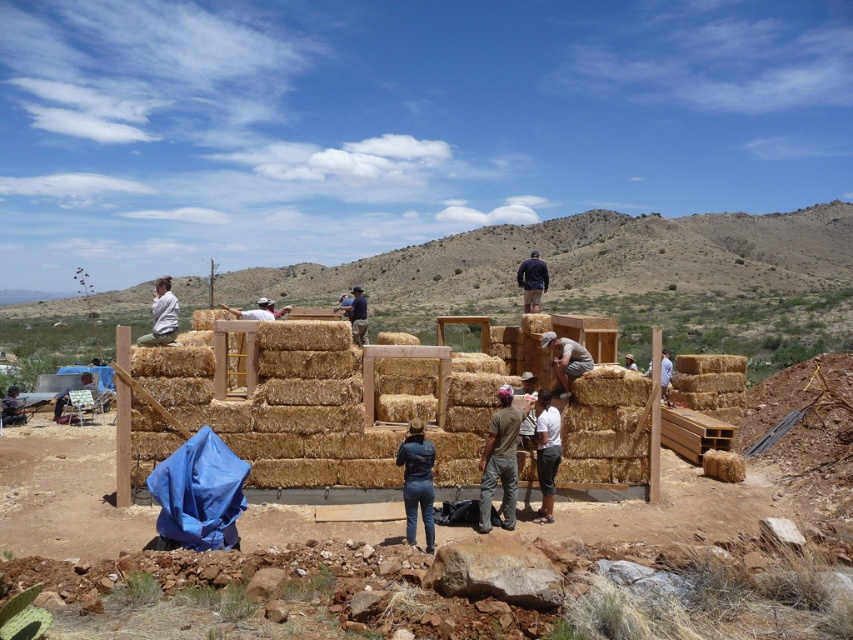
Does point (485, 461) come farther from viewer compared to point (553, 369)?

No, it is in front of (553, 369).

Consider the image. Can you confirm if brown cotton shirt at center is positioned below brown straw bale at center?

Yes.

In order to click on brown cotton shirt at center in this screenshot , I will do `click(498, 461)`.

Is dark blue jeans at center further to the viewer compared to dark gray fabric pants at lower center?

No, it is in front of dark gray fabric pants at lower center.

Does dark blue jeans at center appear over dark gray fabric pants at lower center?

No.

Is point (425, 538) more distant than point (550, 492)?

No.

This screenshot has height=640, width=853. Find the location of `dark blue jeans at center`. dark blue jeans at center is located at coordinates (416, 481).

Can you confirm if natural straw bales at center is thinner than brown cotton shirt at center?

In fact, natural straw bales at center might be wider than brown cotton shirt at center.

Is natural straw bales at center in front of brown cotton shirt at center?

Yes, it is.

Is point (202, 428) behind point (509, 392)?

No, it is in front of (509, 392).

At what (x,y) coordinates should I click in order to perform the action: click on natural straw bales at center. Please return your answer as a coordinate pair (x, y). The width and height of the screenshot is (853, 640). Looking at the image, I should click on (234, 566).